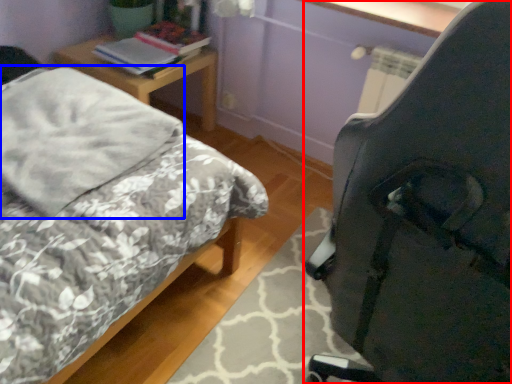
Question: Which object is further to the camera taking this photo, chair (highlighted by a red box) or pillow (highlighted by a blue box)?

Choices:
 (A) chair
 (B) pillow

Answer: (B)